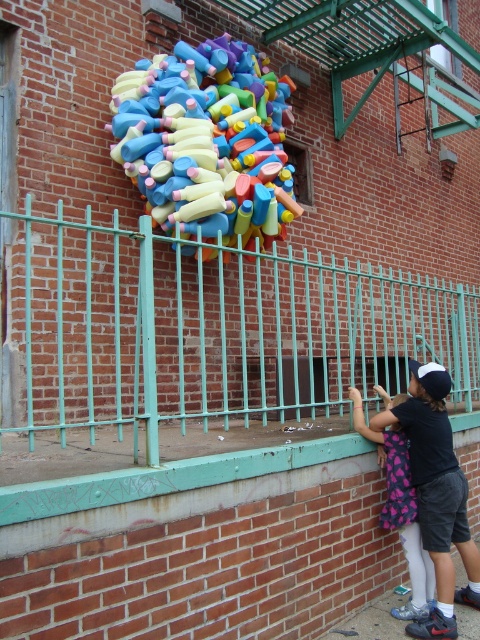
You are a delivery person who needs to place a package between the multicolored plastic bottles at center and the black cotton shirt at lower right. The package requires a minimum of 2 meters of space. Can you fit it there?

The multicolored plastic bottles at center and the black cotton shirt at lower right are 2.18 meters apart from each other. Since the required space is 2 meters, the package can be placed between them as the distance is sufficient.

You are a painter standing in front of the brick wall. You need to place a large canvas between the teal metal fence at center and the black cotton shirt at lower right. Which object should you place the canvas closer to to ensure it fits within the available space?

The teal metal fence at center is larger in size than the black cotton shirt at lower right, so the canvas should be placed closer to the black cotton shirt at lower right to accommodate the larger size of the teal metal fence at center.

You are a photographer trying to capture the multicolored plastic bottles at center in your shot. The camera you are using has a focus point at coordinate point (x=205, y=144). Will the multicolored plastic bottles at center be in focus?

The multicolored plastic bottles at center is located at point (x=205, y=144), so yes, the multicolored plastic bottles at center will be in focus since the focus point is exactly at that coordinate.